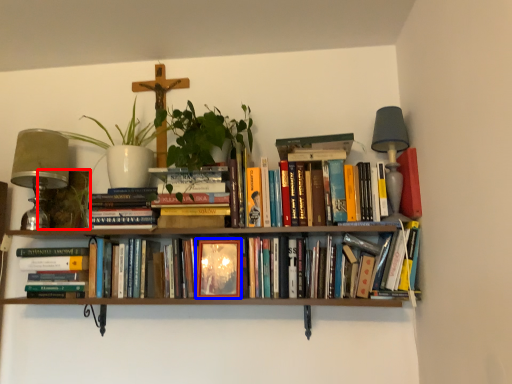
Question: Which of the following is the closest to the observer, plant (highlighted by a red box) or paperback book (highlighted by a blue box)?

Choices:
 (A) plant
 (B) paperback book

Answer: (B)